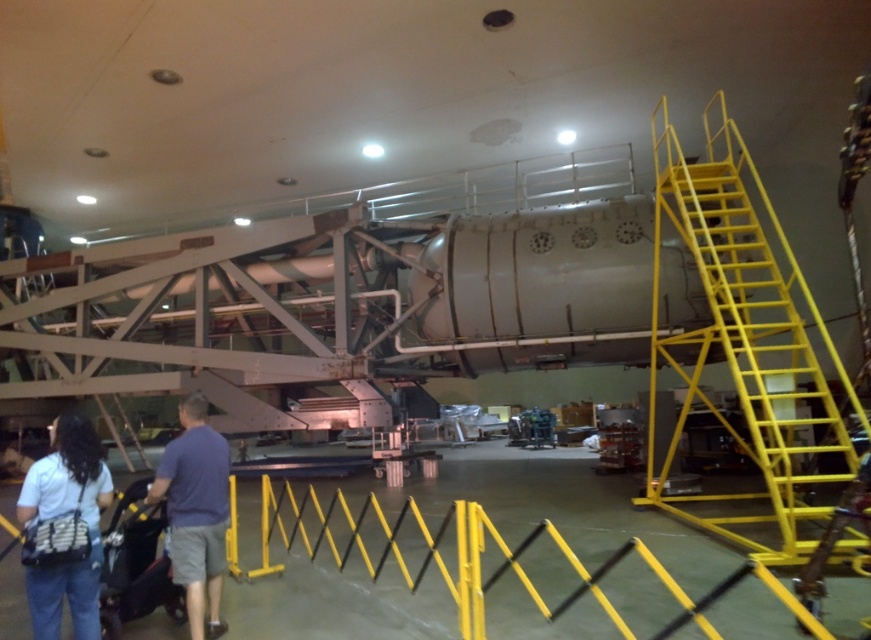
You need to carry a long ladder that is 2 meters wide through the area. Which path should you choose between the yellow metallic staircase at right and the yellow metal barrier at lower center?

The yellow metal barrier at lower center is wider than the yellow metallic staircase at right, so you should choose the path near the yellow metal barrier at lower center since its width can accommodate the 2 meter wide ladder.

You are a visitor in the hangar and want to approach the rocket engine. There is a yellow metal barrier at lower center and a blue cotton shirt at lower left in your way. Which object must you move past first?

The yellow metal barrier at lower center is in front of the blue cotton shirt at lower left, so you must move past the yellow metal barrier at lower center first before reaching the blue cotton shirt at lower left.